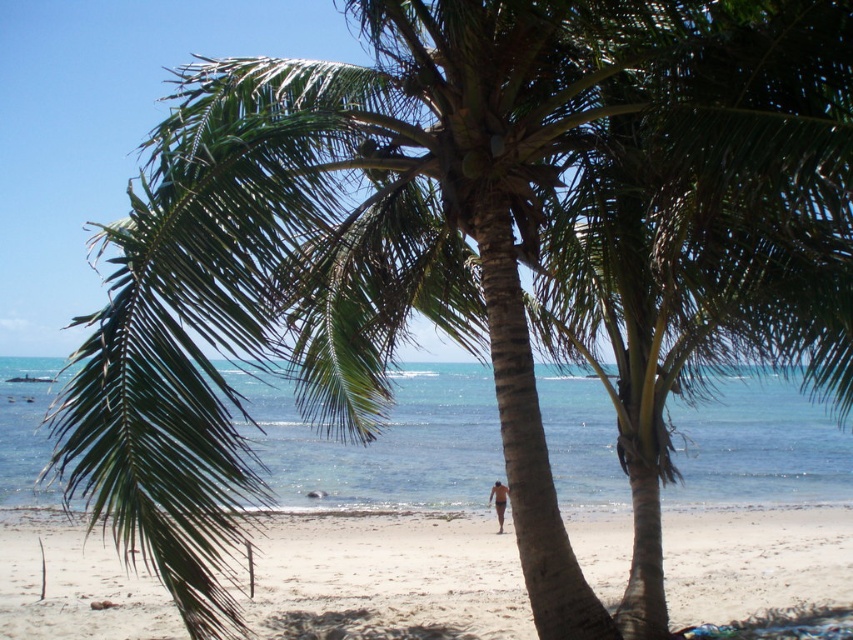
Question: Which of the following is the closest to the observer?

Choices:
 (A) (84, 580)
 (B) (677, 486)

Answer: (A)

Question: Is sandy beach at lower center below clear blue water at center?

Choices:
 (A) no
 (B) yes

Answer: (B)

Question: Does sandy beach at lower center have a lesser width compared to clear blue water at center?

Choices:
 (A) no
 (B) yes

Answer: (B)

Question: Which point appears closest to the camera in this image?

Choices:
 (A) (314, 467)
 (B) (502, 561)

Answer: (B)

Question: Is sandy beach at lower center below clear blue water at center?

Choices:
 (A) yes
 (B) no

Answer: (A)

Question: Which point is closer to the camera?

Choices:
 (A) (502, 600)
 (B) (405, 470)

Answer: (A)